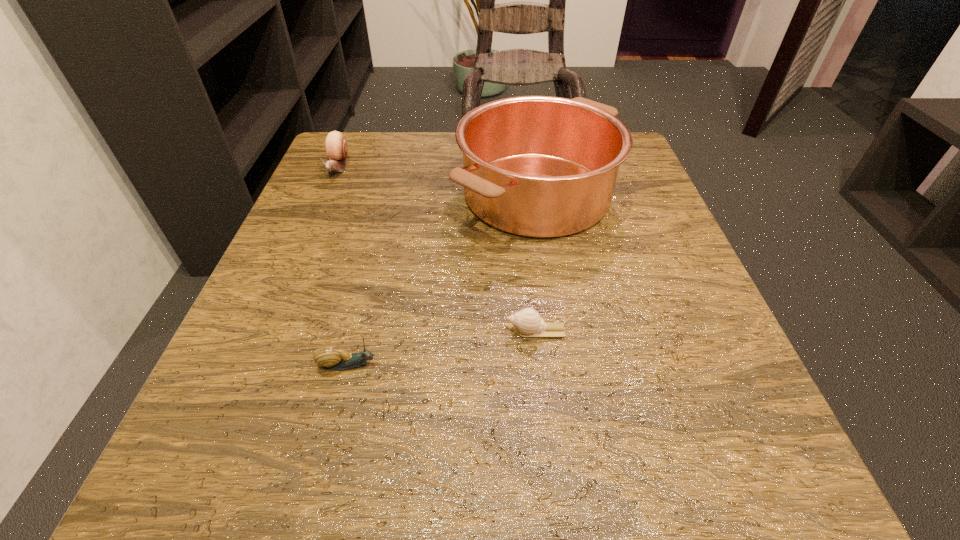
This screenshot has width=960, height=540. I want to click on the tallest object, so click(x=537, y=166).

Identify the location of the third shortest object. (336, 148).

Where is `the leftmost object`? The height and width of the screenshot is (540, 960). the leftmost object is located at coordinates (336, 148).

Find the location of a particular element. the nearest object is located at coordinates (329, 356).

What are the coordinates of `the nearest escargot` in the screenshot? It's located at (329, 356).

Locate an element on the screen. the rightmost escargot is located at coordinates (527, 322).

This screenshot has height=540, width=960. In order to click on the second nearest escargot in this screenshot , I will do `click(527, 322)`.

Where is `vacant space located on the front of the saucepan`? vacant space located on the front of the saucepan is located at coordinates (577, 454).

Locate an element on the screen. The height and width of the screenshot is (540, 960). vacant space situated 0.060m on the front-facing side of the farthest escargot is located at coordinates (324, 199).

Image resolution: width=960 pixels, height=540 pixels. Identify the location of vacant space located 0.220m on the front-facing side of the nearest escargot. (541, 364).